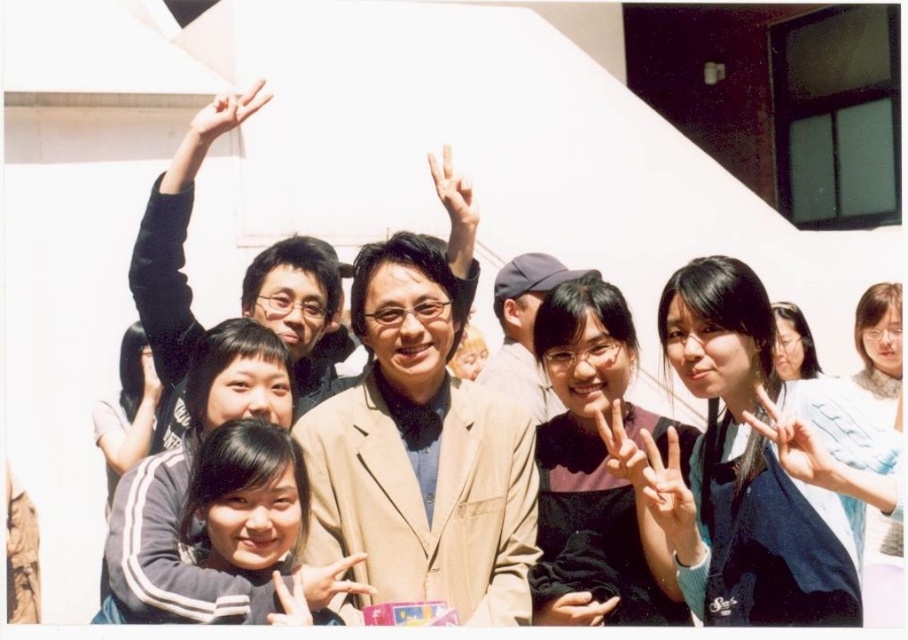
You are a photographer trying to adjust the lighting for a group photo. You notice the matte beige blazer at center and the matte black hand at center in the frame. Which object is positioned to the left of the other?

The matte beige blazer at center is to the left of the matte black hand at center.

Consider the image. In the scene where a group of people are posing for a photo outdoors on a sunny day, with the man at center wearing a beige blazer over a blue shirt and others around him in casual attire, there is a point marked at coordinates (421, 452). What object or clothing item is located at this coordinate?

The point at coordinates (421, 452) corresponds to the beige fabric jacket at center.